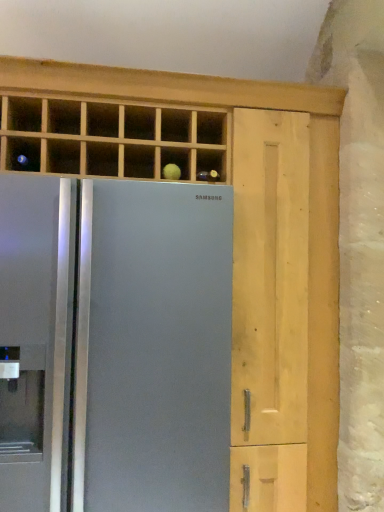
Question: Should I look upward or downward to see satin silver refrigerator at center?

Choices:
 (A) up
 (B) down

Answer: (B)